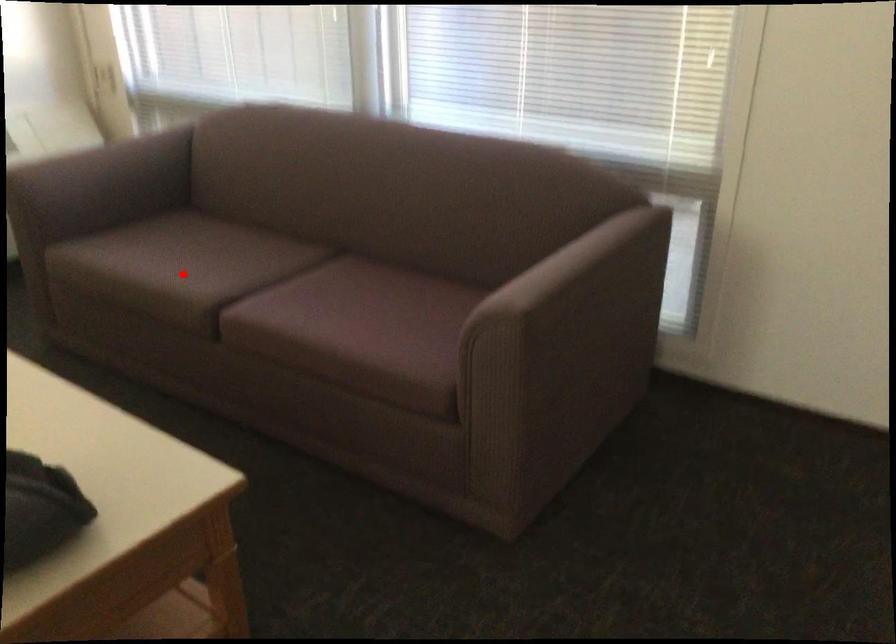
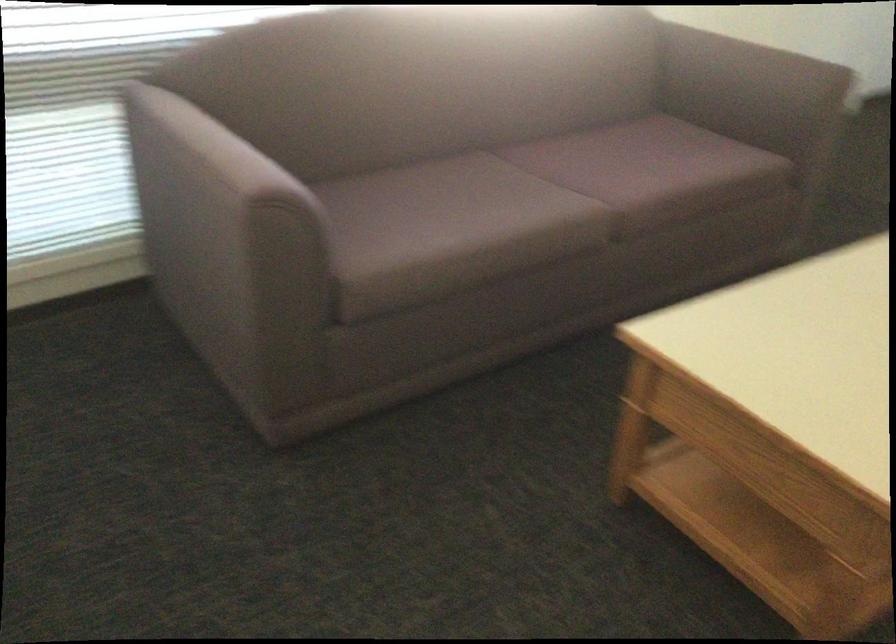
Locate, in the second image, the point that corresponds to the highlighted location in the first image.

(528, 205)